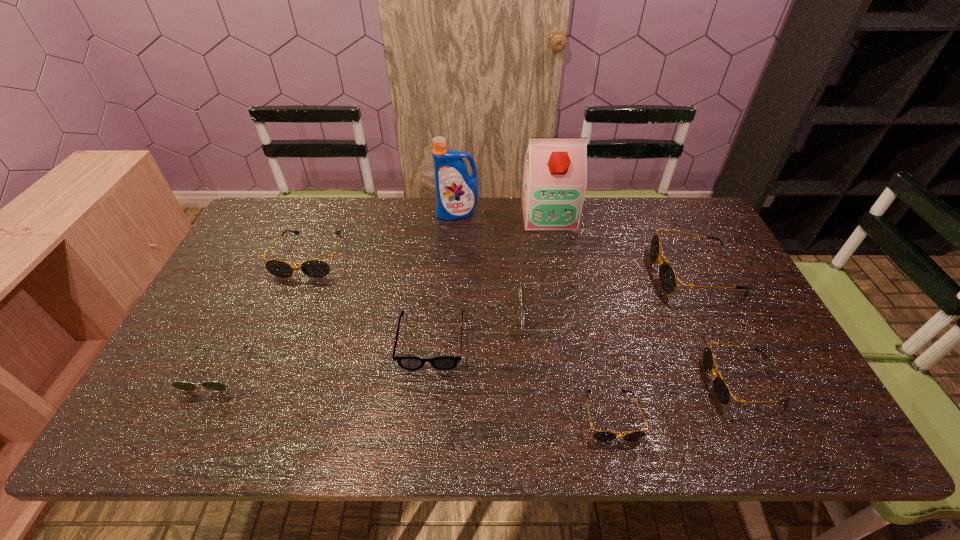
The width and height of the screenshot is (960, 540). In order to click on free point between the third tallest object and the bigger green sunglasses in this screenshot , I will do `click(623, 294)`.

You are a GUI agent. You are given a task and a screenshot of the screen. Output one action in this format:
    pyautogui.click(x=<x>, y=<y>)
    Task: Click on the vacant point located between the seventh shortest object and the soya milk
    
    Given the screenshot: What is the action you would take?
    pyautogui.click(x=622, y=244)

This screenshot has height=540, width=960. Identify the location of blank region between the left green sunglasses and the detergent. (336, 292).

Image resolution: width=960 pixels, height=540 pixels. I want to click on free area in between the detergent and the leftmost black sunglasses, so click(384, 234).

Where is `free space between the soya milk and the left green sunglasses`? free space between the soya milk and the left green sunglasses is located at coordinates (382, 292).

Where is `unoccupied position between the smaller green sunglasses and the soya milk`? unoccupied position between the smaller green sunglasses and the soya milk is located at coordinates (382, 292).

Where is `vacant space that is in between the detergent and the tallest sunglasses`? vacant space that is in between the detergent and the tallest sunglasses is located at coordinates (577, 244).

Identify the location of object identified as the fourth closest to the third smallest black sunglasses. This screenshot has height=540, width=960. (520, 294).

You are a GUI agent. You are given a task and a screenshot of the screen. Output one action in this format:
    pyautogui.click(x=<x>, y=<y>)
    Task: Click on the fifth closest object to the smaller green sunglasses
    The height and width of the screenshot is (540, 960).
    Given the screenshot: What is the action you would take?
    pyautogui.click(x=599, y=435)

Locate an element on the screen. This screenshot has width=960, height=540. sunglasses identified as the sixth closest to the detergent is located at coordinates (721, 390).